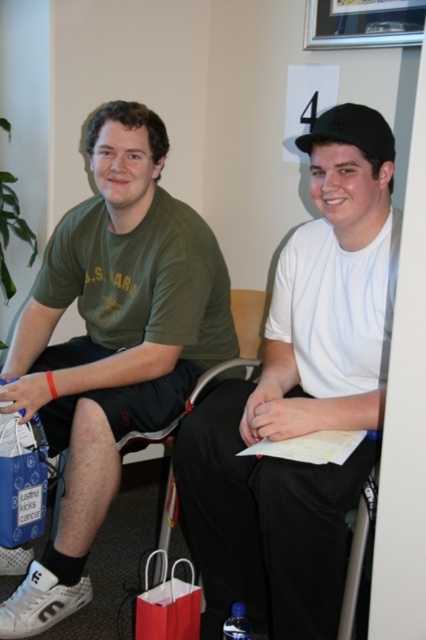
Can you confirm if metallic silver chair at center is taller than black matte baseball cap at upper right?

Correct, metallic silver chair at center is much taller as black matte baseball cap at upper right.

Between metallic silver chair at center and black matte baseball cap at upper right, which one has less height?

With less height is black matte baseball cap at upper right.

This screenshot has width=426, height=640. I want to click on metallic silver chair at center, so click(239, 339).

Who is lower down, blue fabric shopping bag at lower left or black matte baseball cap at upper right?

blue fabric shopping bag at lower left is lower down.

Who is shorter, blue fabric shopping bag at lower left or black matte baseball cap at upper right?

With less height is black matte baseball cap at upper right.

This screenshot has height=640, width=426. I want to click on blue fabric shopping bag at lower left, so click(22, 480).

Find the location of a particular element. blue fabric shopping bag at lower left is located at coordinates [x=22, y=480].

Which of these two, blue fabric shopping bag at lower left or metallic silver chair at center, stands shorter?

blue fabric shopping bag at lower left

Which is above, blue fabric shopping bag at lower left or metallic silver chair at center?

metallic silver chair at center

Is point (25, 472) farther from viewer compared to point (235, 358)?

That is False.

Where is `blue fabric shopping bag at lower left`? blue fabric shopping bag at lower left is located at coordinates coord(22,480).